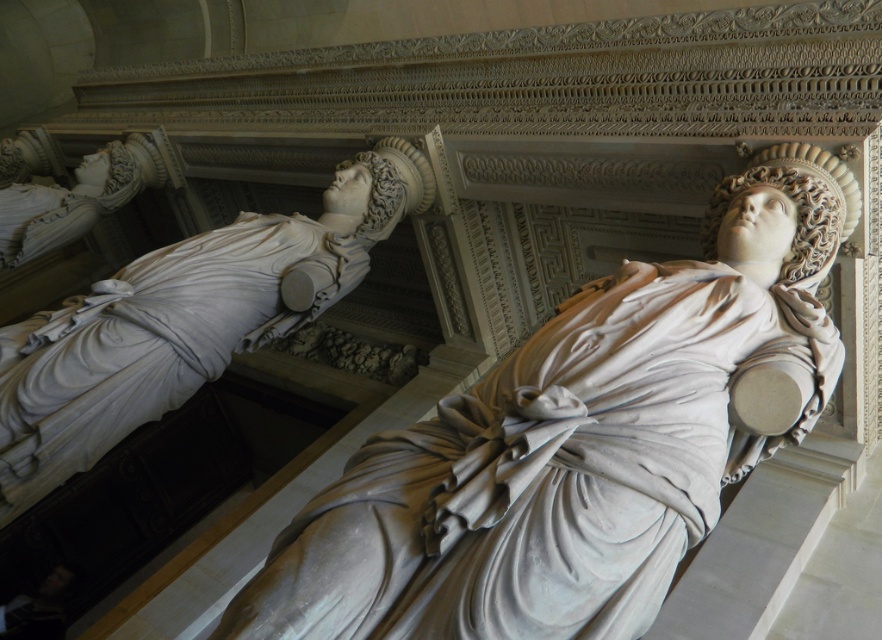
Question: Considering the relative positions of white marble statue at center and white marble statue at upper left in the image provided, where is white marble statue at center located with respect to white marble statue at upper left?

Choices:
 (A) right
 (B) left

Answer: (A)

Question: Which point is closer to the camera taking this photo?

Choices:
 (A) (230, 291)
 (B) (559, 550)

Answer: (B)

Question: Is the position of white marble statue at center more distant than that of white marble statue at upper left?

Choices:
 (A) no
 (B) yes

Answer: (A)

Question: Can you confirm if white marble statue at center is thinner than white marble statue at upper left?

Choices:
 (A) no
 (B) yes

Answer: (A)

Question: Which point appears closest to the camera in this image?

Choices:
 (A) (131, 262)
 (B) (380, 592)

Answer: (B)